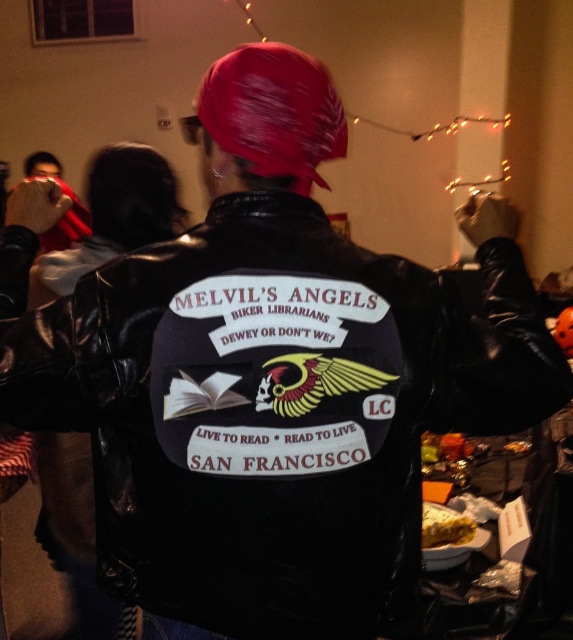
You are at a biker rally and need to decide if your backpack can fit through the gap between the black leather jacket at center and the yellow crumbly cake at lower right. Your backpack is 1.2 meters wide. Can it fit?

The black leather jacket at center might be wider than yellow crumbly cake at lower right. Since the jacket could be wider, the gap between them might be narrower than 1.2 meters. Therefore, your backpack might not fit through the gap.

You are at a party and see a black leather jacket at center and a yellow crumbly cake at lower right. Which object is larger?

The black leather jacket at center is bigger than the yellow crumbly cake at lower right.

You are at a party where the black leather jacket at center and the yellow crumbly cake at lower right are both present. If you want to take a piece of the cake without touching the jacket, which direction should you move relative to the jacket?

Since the black leather jacket at center is located above the yellow crumbly cake at lower right, you should move downward from the jacket to reach the cake without touching it.